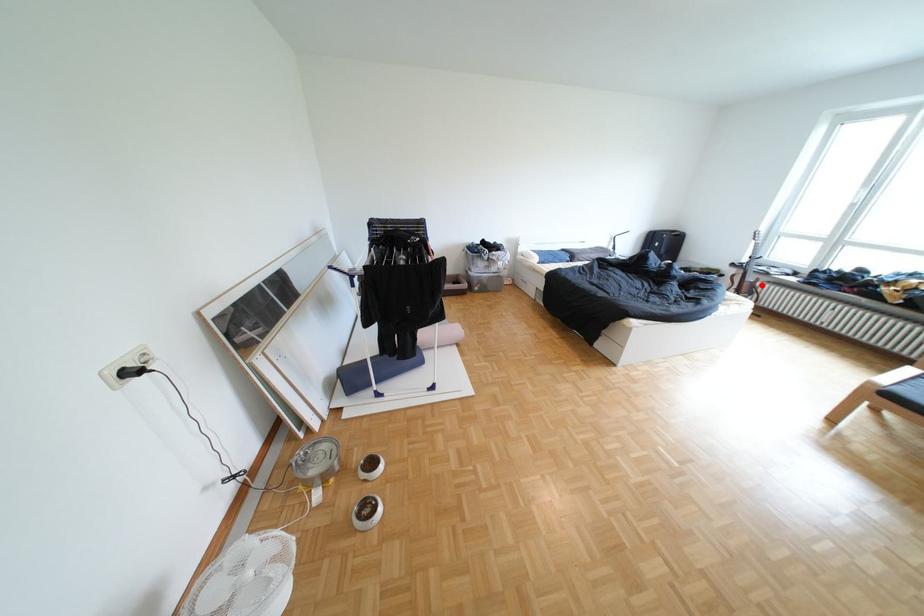
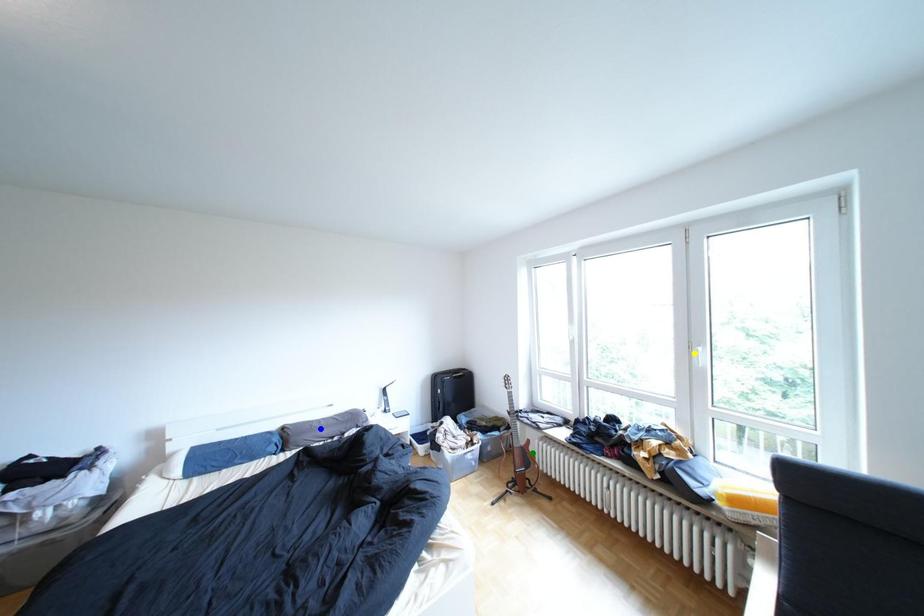
Question: I am providing you with two images of the same scene from different viewpoints. A red point is marked on the first image. You are given multiple points on the second image. Which point in image 2 represents the same 3d spot as the red point in image 1?

Choices:
 (A) green point
 (B) yellow point
 (C) blue point

Answer: (A)